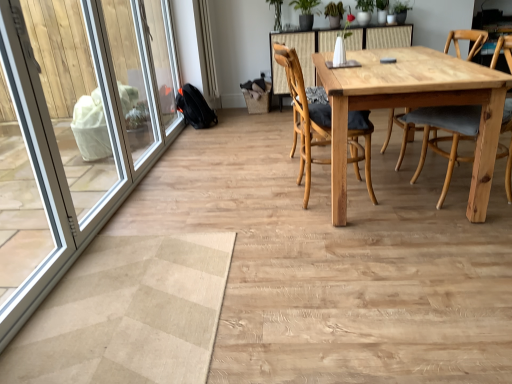
What do you see at coordinates (75, 130) in the screenshot? I see `white plastic screen door at left` at bounding box center [75, 130].

Measure the distance between point [275,11] and camera.

Point [275,11] and camera are 15.03 feet apart.

This screenshot has width=512, height=384. What are the coordinates of `white plastic screen door at left` in the screenshot? It's located at (75, 130).

Are natural wood table at center and white plastic screen door at left far apart?

Absolutely, natural wood table at center is distant from white plastic screen door at left.

In terms of width, does natural wood table at center look wider or thinner when compared to white plastic screen door at left?

Considering their sizes, natural wood table at center looks broader than white plastic screen door at left.

From the image's perspective, between natural wood table at center and white plastic screen door at left, which one is located above?

natural wood table at center appears higher in the image.

Is point (410, 51) closer to camera compared to point (26, 80)?

No.

Is green leafy plant at upper center closer to camera compared to white plastic screen door at left?

No, green leafy plant at upper center is behind white plastic screen door at left.

From the picture: Is green leafy plant at upper center directly adjacent to white plastic screen door at left?

green leafy plant at upper center and white plastic screen door at left are clearly separated.

Which of these two, green leafy plant at upper center or white plastic screen door at left, is wider?

Wider between the two is green leafy plant at upper center.

From a real-world perspective, is green leafy plant at upper center under white plastic screen door at left?

No, from a real-world perspective, green leafy plant at upper center is not under white plastic screen door at left.

In the scene shown: In terms of height, does natural wood table at center look taller or shorter compared to green leafy plant at upper center?

In the image, natural wood table at center appears to be taller than green leafy plant at upper center.

Which of these two, natural wood table at center or green leafy plant at upper center, is thinner?

green leafy plant at upper center.

Identify the location of plant above the natural wood table at center (from the image's perspective). (276, 13).

Is natural wood table at center positioned before green leafy plant at upper center?

Yes, natural wood table at center is in front of green leafy plant at upper center.

Considering the sizes of objects white plastic screen door at left and wooden chair at center, which is the first chair from left to right, in the image provided, who is shorter, white plastic screen door at left or wooden chair at center, which is the first chair from left to right,?

With less height is wooden chair at center, which is the first chair from left to right.

Which is farther from the camera, (x=116, y=50) or (x=304, y=200)?

The point (x=116, y=50) is behind.

Between white plastic screen door at left and wooden chair at center, which is the first chair from left to right, which one has smaller size?

Smaller between the two is white plastic screen door at left.

How far apart are white plastic screen door at left and wooden chair at center, the 2th chair positioned from the right?

white plastic screen door at left is 1.74 meters from wooden chair at center, the 2th chair positioned from the right.

Between light brown wood chair at center, the second chair when ordered from left to right, and natural wood table at center, which one has smaller width?

Thinner between the two is light brown wood chair at center, the second chair when ordered from left to right.

Considering the positions of point (426, 126) and point (503, 75), is point (426, 126) closer or farther from the camera than point (503, 75)?

Point (426, 126) appears to be farther away from the viewer than point (503, 75).

Does light brown wood chair at center, acting as the first chair starting from the right, lie in front of natural wood table at center?

No, light brown wood chair at center, acting as the first chair starting from the right, is further to the viewer.

From the image's perspective, would you say green leafy plant at upper center is positioned over light brown wood chair at center, acting as the first chair starting from the right?

Yes, from the image's perspective, green leafy plant at upper center is over light brown wood chair at center, acting as the first chair starting from the right.

Locate an element on the screen. The image size is (512, 384). plant above the light brown wood chair at center, acting as the first chair starting from the right (from the image's perspective) is located at coordinates (276, 13).

Considering the relative positions of green leafy plant at upper center and light brown wood chair at center, the second chair when ordered from left to right, in the image provided, is green leafy plant at upper center to the left or to the right of light brown wood chair at center, the second chair when ordered from left to right,?

In the image, green leafy plant at upper center appears on the left side of light brown wood chair at center, the second chair when ordered from left to right.

Does point (279, 0) come behind point (469, 133)?

Yes, it is behind point (469, 133).

Can you confirm if wooden chair at center, which is the first chair from left to right, is positioned to the left of green leafy plant at upper center?

In fact, wooden chair at center, which is the first chair from left to right, is to the right of green leafy plant at upper center.

From a real-world perspective, is wooden chair at center, the 2th chair positioned from the right, positioned above or below green leafy plant at upper center?

From a real-world perspective, wooden chair at center, the 2th chair positioned from the right, is physically below green leafy plant at upper center.

Who is taller, wooden chair at center, which is the first chair from left to right, or green leafy plant at upper center?

Standing taller between the two is wooden chair at center, which is the first chair from left to right.

Considering the sizes of objects wooden chair at center, the 2th chair positioned from the right, and green leafy plant at upper center in the image provided, who is smaller, wooden chair at center, the 2th chair positioned from the right, or green leafy plant at upper center?

Smaller between the two is green leafy plant at upper center.

In the image, there is a natural wood table at center. Where is `screen door below it (from the image's perspective)`? screen door below it (from the image's perspective) is located at coordinates (75, 130).

In the image, there is a white plastic screen door at left. What are the coordinates of `plant above it (from the image's perspective)` in the screenshot? It's located at (x=276, y=13).

Considering their positions, is light brown wood chair at center, acting as the first chair starting from the right, positioned closer to wooden chair at center, the 2th chair positioned from the right, than white plastic screen door at left?

light brown wood chair at center, acting as the first chair starting from the right, lies closer to wooden chair at center, the 2th chair positioned from the right, than the other object.

Based on their spatial positions, is green leafy plant at upper center or white plastic screen door at left closer to natural wood table at center?

white plastic screen door at left is closer to natural wood table at center.

Considering their positions, is white plastic screen door at left positioned closer to natural wood table at center than wooden chair at center, the 2th chair positioned from the right?

The object closer to natural wood table at center is wooden chair at center, the 2th chair positioned from the right.

When comparing their distances from white plastic screen door at left, does wooden chair at center, the 2th chair positioned from the right, or light brown wood chair at center, acting as the first chair starting from the right, seem closer?

wooden chair at center, the 2th chair positioned from the right, is closer to white plastic screen door at left.

Considering their positions, is light brown wood chair at center, the second chair when ordered from left to right, positioned further to white plastic screen door at left than green leafy plant at upper center?

light brown wood chair at center, the second chair when ordered from left to right, is positioned further to the anchor white plastic screen door at left.

Looking at the image, which one is located further to natural wood table at center, green leafy plant at upper center or wooden chair at center, the 2th chair positioned from the right?

The object further to natural wood table at center is green leafy plant at upper center.

Estimate the real-world distances between objects in this image. Which object is further from wooden chair at center, the 2th chair positioned from the right, natural wood table at center or green leafy plant at upper center?

green leafy plant at upper center is further to wooden chair at center, the 2th chair positioned from the right.

Estimate the real-world distances between objects in this image. Which object is closer to natural wood table at center, wooden chair at center, which is the first chair from left to right, or light brown wood chair at center, acting as the first chair starting from the right?

light brown wood chair at center, acting as the first chair starting from the right, lies closer to natural wood table at center than the other object.

Find the location of `kitchen & dining room table between white plastic screen door at left and light brown wood chair at center, acting as the first chair starting from the right`. kitchen & dining room table between white plastic screen door at left and light brown wood chair at center, acting as the first chair starting from the right is located at coordinates (413, 106).

At what (x,y) coordinates should I click in order to perform the action: click on kitchen & dining room table between white plastic screen door at left and green leafy plant at upper center in the front-back direction. Please return your answer as a coordinate pair (x, y). This screenshot has width=512, height=384. Looking at the image, I should click on (413, 106).

You are a GUI agent. You are given a task and a screenshot of the screen. Output one action in this format:
    pyautogui.click(x=<x>, y=<y>)
    Task: Click on the chair between white plastic screen door at left and natural wood table at center in the horizontal direction
    
    Given the screenshot: What is the action you would take?
    pyautogui.click(x=304, y=116)

You are a GUI agent. You are given a task and a screenshot of the screen. Output one action in this format:
    pyautogui.click(x=<x>, y=<y>)
    Task: Click on the chair between light brown wood chair at center, the second chair when ordered from left to right, and green leafy plant at upper center, along the z-axis
    This screenshot has height=384, width=512.
    Given the screenshot: What is the action you would take?
    pyautogui.click(x=304, y=116)